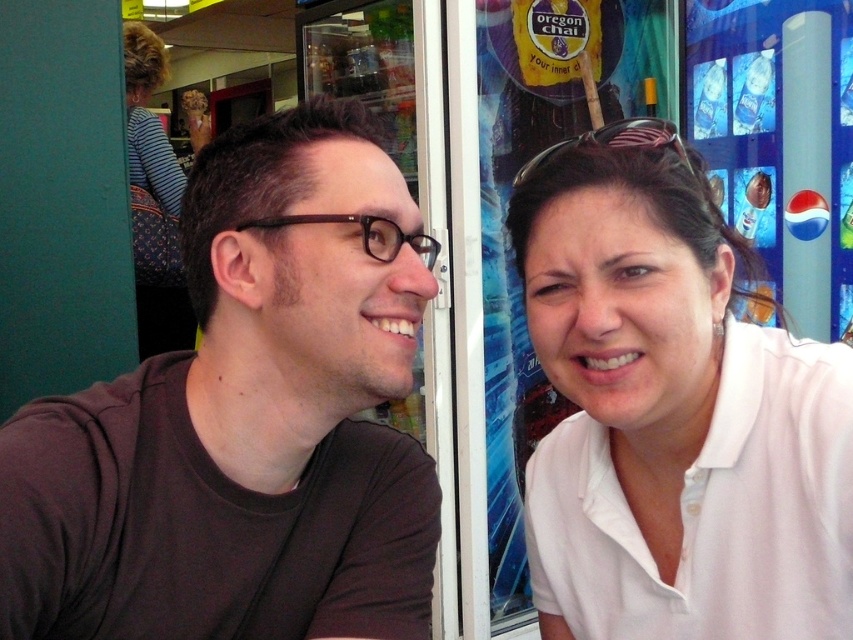
You are a fashion designer observing two shirts in a photo. The brown matte shirt at left and the white smooth shirt at right. Which shirt has a greater width?

The brown matte shirt at left has a greater width than the white smooth shirt at right according to the description.

You are taking a photo with your smartphone camera. The camera is 36.03 inches away from the point at coordinates [428,520]. If you want to include both people in the frame, will you need to zoom in or out?

The camera is 36.03 inches away from the point at coordinates [428,520]. To include both people in the frame, you would need to zoom out to widen the field of view, allowing both individuals to fit within the photo.